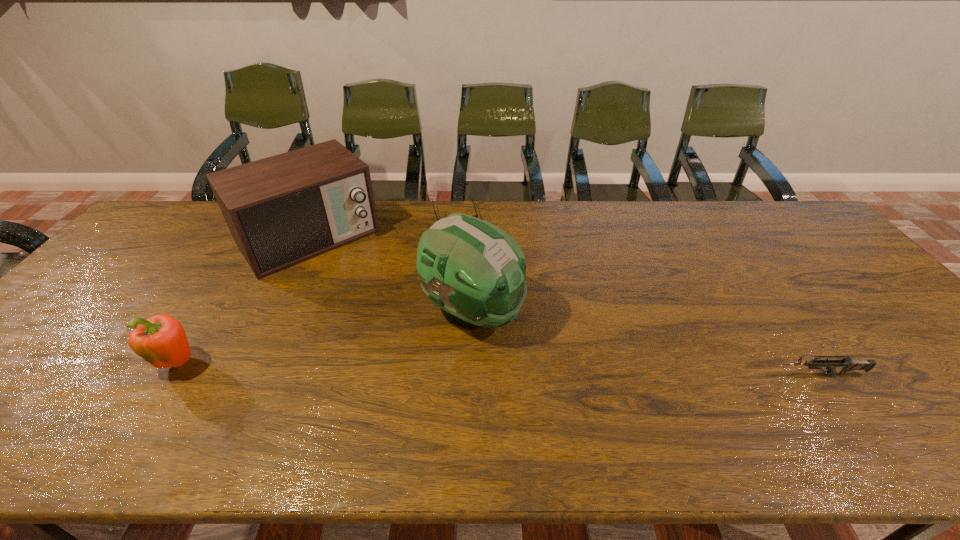
You are a GUI agent. You are given a task and a screenshot of the screen. Output one action in this format:
    pyautogui.click(x=<x>, y=<y>)
    Task: Click on the vacant space in between the pepper and the football helmet
    The width and height of the screenshot is (960, 540).
    Given the screenshot: What is the action you would take?
    pyautogui.click(x=325, y=338)

This screenshot has height=540, width=960. Find the location of `vacant area between the gun and the shortest object`. vacant area between the gun and the shortest object is located at coordinates click(x=638, y=295).

Find the location of a particular element. This screenshot has height=540, width=960. vacant space that is in between the football helmet and the third tallest object is located at coordinates (325, 338).

Identify the location of unoccupied position between the radio receiver and the second shortest object. Image resolution: width=960 pixels, height=540 pixels. (564, 305).

The image size is (960, 540). Find the location of `empty space that is in between the gun and the radio receiver`. empty space that is in between the gun and the radio receiver is located at coordinates (564, 305).

Where is `empty space that is in between the rightmost object and the radio receiver`? empty space that is in between the rightmost object and the radio receiver is located at coordinates (564, 305).

The width and height of the screenshot is (960, 540). I want to click on object that ranks as the closest to the pepper, so click(281, 210).

Identify which object is located as the third nearest to the fourth tallest object. Please provide its 2D coordinates. Your answer should be formatted as a tuple, i.e. [(x, y)], where the tuple contains the x and y coordinates of a point satisfying the conditions above.

[(281, 210)]

Find the location of a particular element. The height and width of the screenshot is (540, 960). free location that satisfies the following two spatial constraints: 1. on the front side of the second shortest object; 2. aimed along the barrel of the pepper is located at coordinates tap(173, 374).

Where is `vacant position in the image that satisfies the following two spatial constraints: 1. on the front side of the football helmet; 2. aimed along the barrel of the rightmost object`? The width and height of the screenshot is (960, 540). vacant position in the image that satisfies the following two spatial constraints: 1. on the front side of the football helmet; 2. aimed along the barrel of the rightmost object is located at coordinates (471, 374).